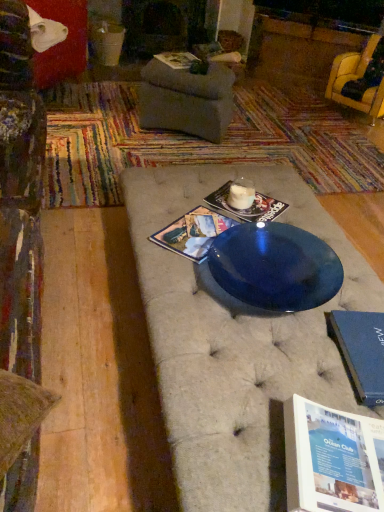
Image resolution: width=384 pixels, height=512 pixels. In order to click on free spot above matte paper magazine at center, the second magazine viewed from the back (from a real-world perspective) in this screenshot , I will do `click(254, 199)`.